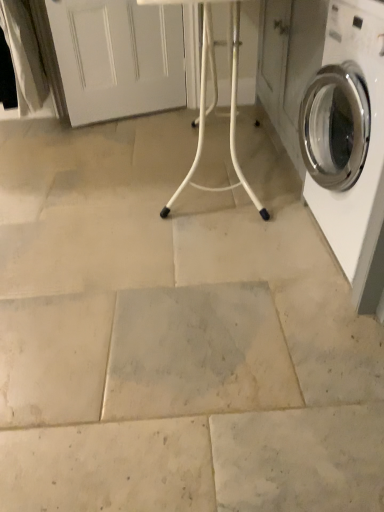
The image size is (384, 512). What do you see at coordinates (350, 125) in the screenshot?
I see `white glossy washing machine at right` at bounding box center [350, 125].

Identify the location of white glossy washing machine at right. This screenshot has width=384, height=512. (350, 125).

At what (x,y) coordinates should I click in order to perform the action: click on white plastic table at center. Please return your answer as a coordinate pair (x, y). Looking at the image, I should click on pyautogui.click(x=214, y=97).

What is the approximate width of white plastic table at center?

19.76 inches.

The height and width of the screenshot is (512, 384). What do you see at coordinates (214, 97) in the screenshot?
I see `white plastic table at center` at bounding box center [214, 97].

I want to click on white glossy washing machine at right, so click(x=350, y=125).

Which object is positioned more to the left, white glossy washing machine at right or white plastic table at center?

white plastic table at center is more to the left.

Which object is further away from the camera, white glossy washing machine at right or white plastic table at center?

white plastic table at center is behind.

Does point (365, 51) appear closer or farther from the camera than point (237, 79)?

Point (365, 51).

From the image's perspective, is white glossy washing machine at right under white plastic table at center?

Yes, from the image's perspective, white glossy washing machine at right is below white plastic table at center.

Based on the photo, from a real-world perspective, which object rests below the other?

In real-world perspective, white glossy washing machine at right is lower.

Which of these two, white glossy washing machine at right or white plastic table at center, is wider?

white plastic table at center.

From the picture: Can you confirm if white glossy washing machine at right is taller than white plastic table at center?

No, white glossy washing machine at right is not taller than white plastic table at center.

Does white glossy washing machine at right have a larger size compared to white plastic table at center?

Incorrect, white glossy washing machine at right is not larger than white plastic table at center.

Is white glossy washing machine at right not within white plastic table at center?

That's correct, white glossy washing machine at right is outside of white plastic table at center.

Is white glossy washing machine at right in contact with white plastic table at center?

No.

Could you tell me if white glossy washing machine at right is turned towards white plastic table at center?

No, white glossy washing machine at right is not turned towards white plastic table at center.

How much distance is there between white glossy washing machine at right and white plastic table at center?

A distance of 25.80 inches exists between white glossy washing machine at right and white plastic table at center.

The height and width of the screenshot is (512, 384). Find the location of `washing machine below the white plastic table at center (from the image's perspective)`. washing machine below the white plastic table at center (from the image's perspective) is located at coordinates 350,125.

Which object is positioned more to the right, white plastic table at center or white glossy washing machine at right?

white glossy washing machine at right is more to the right.

Is white plastic table at center in front of or behind white glossy washing machine at right in the image?

white plastic table at center is behind white glossy washing machine at right.

Is point (253, 198) farther from viewer compared to point (356, 230)?

Yes, it is behind point (356, 230).

From the image's perspective, which one is positioned lower, white plastic table at center or white glossy washing machine at right?

From the image's view, white glossy washing machine at right is below.

From a real-world perspective, is white plastic table at center physically above white glossy washing machine at right?

Yes, from a real-world perspective, white plastic table at center is on top of white glossy washing machine at right.

Considering the relative sizes of white plastic table at center and white glossy washing machine at right in the image provided, is white plastic table at center wider than white glossy washing machine at right?

Correct, the width of white plastic table at center exceeds that of white glossy washing machine at right.

Can you confirm if white plastic table at center is taller than white glossy washing machine at right?

Indeed, white plastic table at center has a greater height compared to white glossy washing machine at right.

Who is smaller, white plastic table at center or white glossy washing machine at right?

Smaller between the two is white glossy washing machine at right.

Is white plastic table at center not inside white glossy washing machine at right?

Yes, white plastic table at center is not within white glossy washing machine at right.

Would you say white plastic table at center is a long distance from white glossy washing machine at right?

No, white plastic table at center is not far away from white glossy washing machine at right.

Is white plastic table at center oriented towards white glossy washing machine at right?

No, white plastic table at center is not aimed at white glossy washing machine at right.

How different are the orientations of white plastic table at center and white glossy washing machine at right in degrees?

white plastic table at center and white glossy washing machine at right are facing 5.69 degrees away from each other.

How distant is white plastic table at center from white glossy washing machine at right?

A distance of 25.80 inches exists between white plastic table at center and white glossy washing machine at right.

The width and height of the screenshot is (384, 512). Identify the location of washing machine below the white plastic table at center (from a real-world perspective). (350, 125).

In the image, there is a white plastic table at center. Identify the location of washing machine below it (from the image's perspective). The height and width of the screenshot is (512, 384). (350, 125).

The image size is (384, 512). I want to click on washing machine below the white plastic table at center (from a real-world perspective), so click(x=350, y=125).